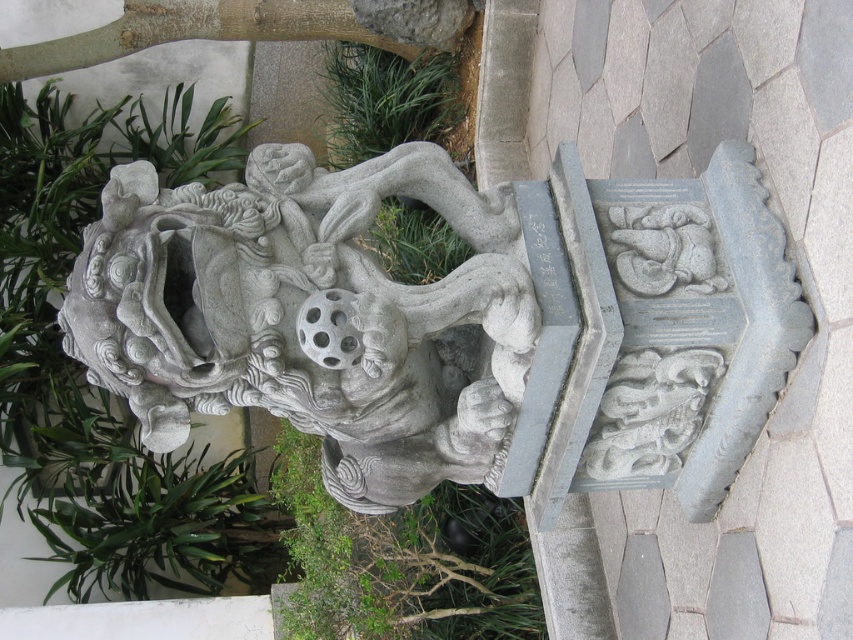
Is point (468, 616) positioned behind point (432, 122)?

No, it is not.

Between point (312, 564) and point (378, 60), which one is positioned in front?

Point (312, 564) is more forward.

Locate an element on the screen. The image size is (853, 640). green leafy plant at center is located at coordinates (403, 561).

Can you confirm if gray stone lion at left is wider than green grass at upper center?

Indeed, gray stone lion at left has a greater width compared to green grass at upper center.

Does gray stone lion at left appear over green grass at upper center?

No.

Does point (505, 236) come farther from viewer compared to point (399, 104)?

No.

Identify the location of gray stone lion at left. This screenshot has width=853, height=640. (308, 316).

Between gray stone lion at left and green leafy plant at center, which one is positioned lower?

green leafy plant at center is lower down.

Is point (347, 474) positioned before point (393, 540)?

Yes, point (347, 474) is closer to viewer.

You are a GUI agent. You are given a task and a screenshot of the screen. Output one action in this format:
    pyautogui.click(x=<x>, y=<y>)
    Task: Click on the gray stone lion at left
    
    Given the screenshot: What is the action you would take?
    pyautogui.click(x=308, y=316)